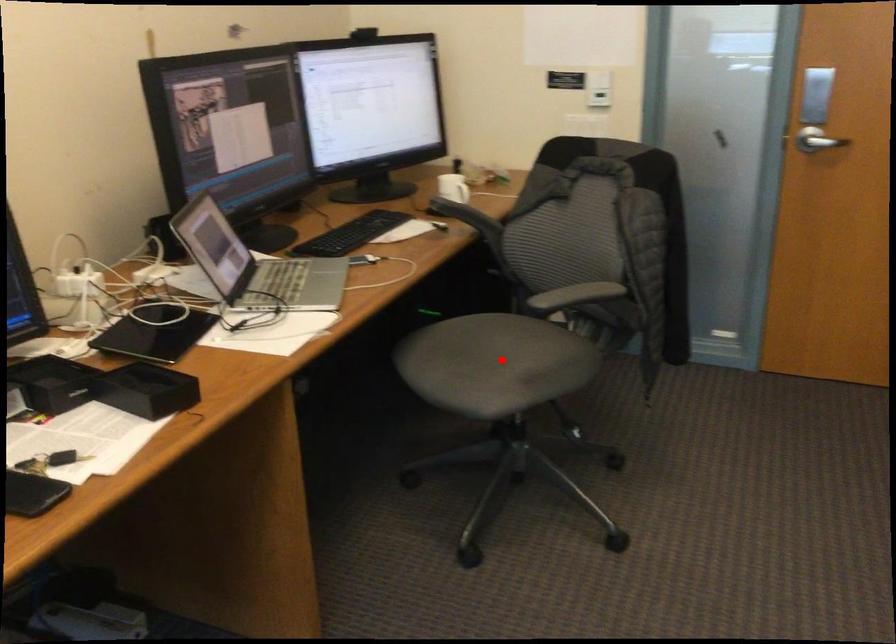
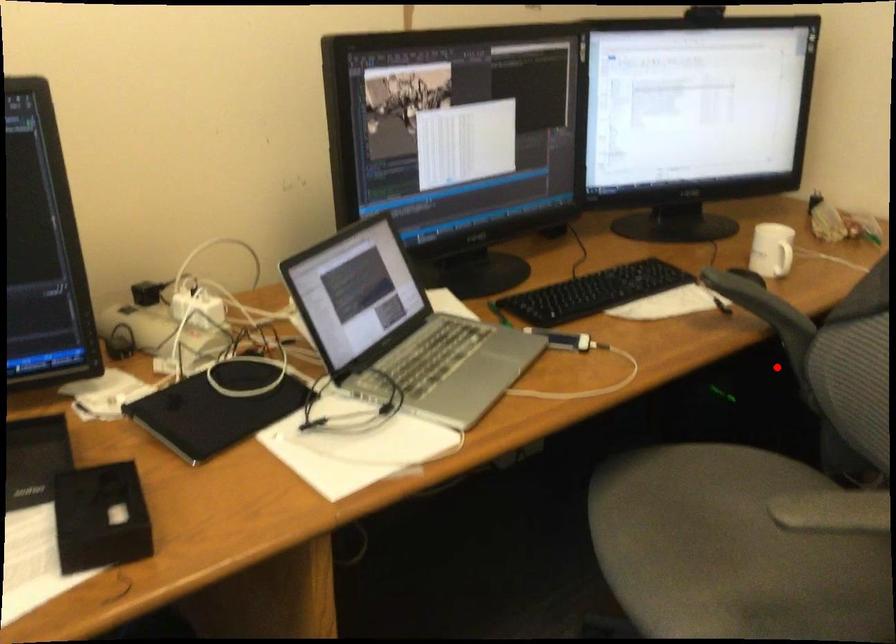
I am providing you with two images of the same scene from different viewpoints. A red point is marked on the first image and another point is marked on the second image. Is the red point in image1 aligned with the point shown in image2?

No